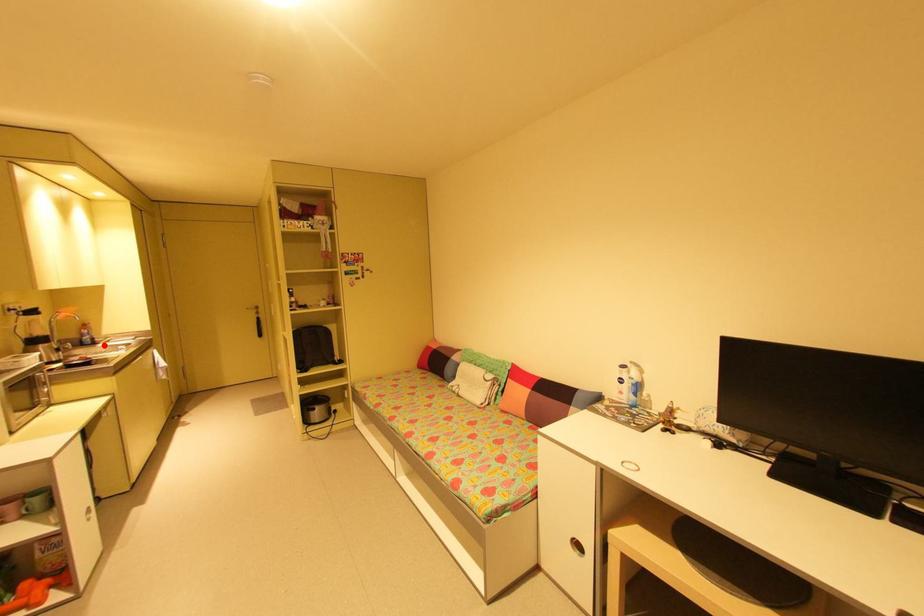
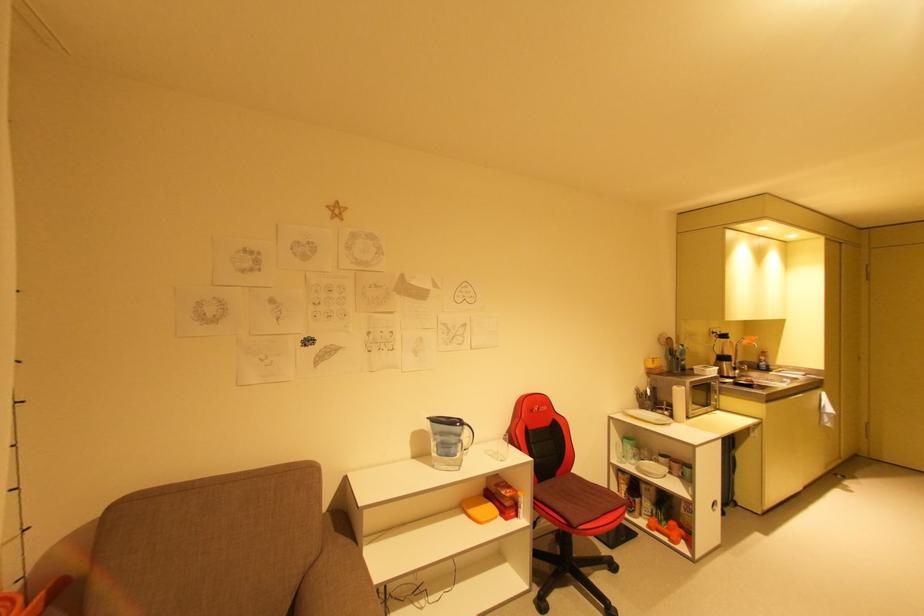
In the second image, find the point that corresponds to the highlighted location in the first image.

(776, 373)